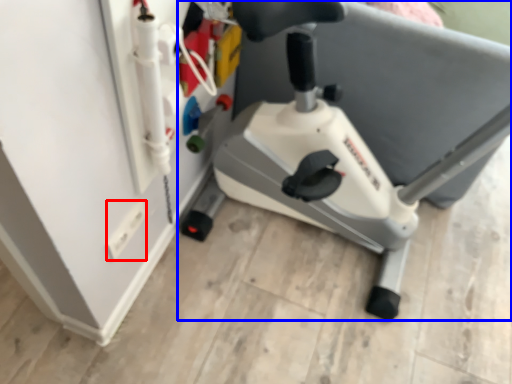
Question: Which of the following is the closest to the observer, electric outlet (highlighted by a red box) or stationary bicycle (highlighted by a blue box)?

Choices:
 (A) electric outlet
 (B) stationary bicycle

Answer: (B)